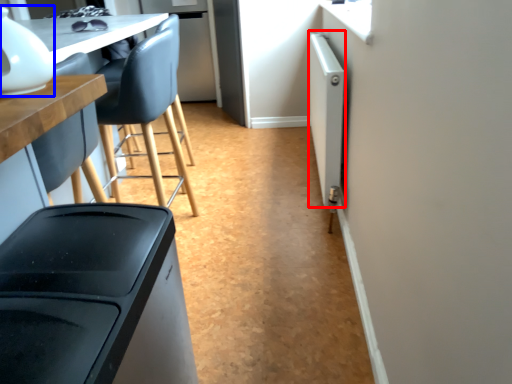
Question: Which object is further to the camera taking this photo, appliance (highlighted by a red box) or appliance (highlighted by a blue box)?

Choices:
 (A) appliance
 (B) appliance

Answer: (A)